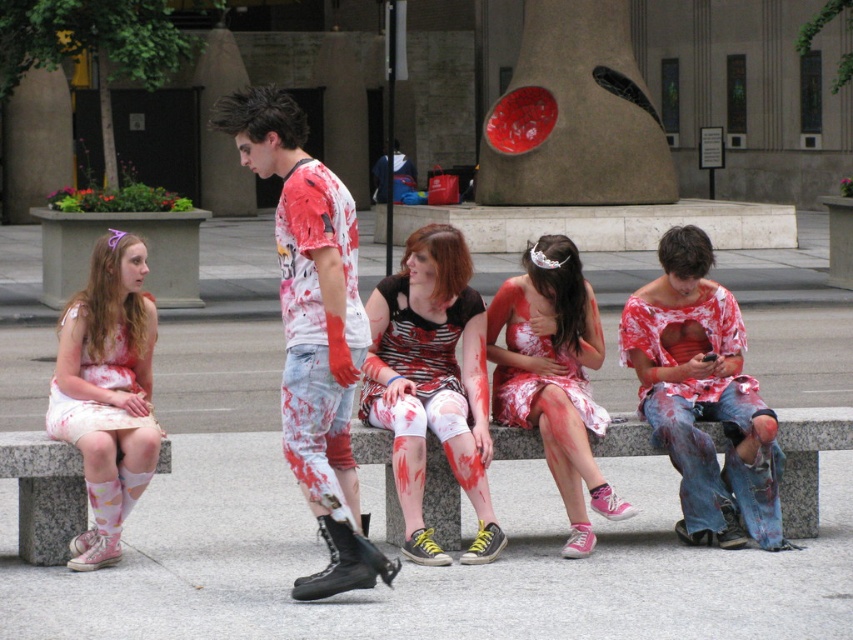
You are standing at the center of the stone bench in the public square. You see two points marked in the scene. The first point is at coordinates point (x=293, y=141) and the second is at point (x=85, y=300). Which point is closer to you?

Point (x=293, y=141) is in front of point (x=85, y=300), so it is closer to you.

You are a photographer at the plaza and want to capture a photo of the two women wearing the white floral dress at left and the matte pink dress at center. From which side should you stand to ensure both are fully visible in the frame?

You should stand to the right of the matte pink dress at center so that both the white floral dress at left and the matte pink dress at center are visible in the frame since the white floral dress at left is positioned on the left side of the matte pink dress at center.

You are a photographer positioned at the camera location. You want to capture a closeup shot of the white floral dress at left. Given that the minimum focusing distance of your camera is 5 meters, can you take the photo without moving closer?

The white floral dress at left is 8.25 meters away from camera, which is beyond the minimum focusing distance of 5 meters. Therefore, you can take the closeup shot without moving closer.